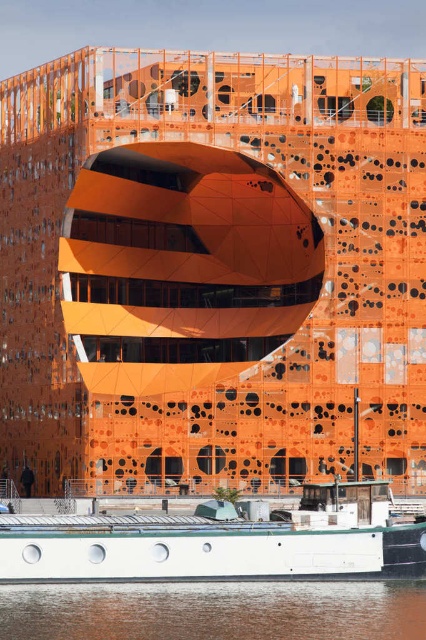
You are a tour guide explaining the scene to visitors. You mention the orange matte building at center and the white matte boat at lower center. How far apart are these two landmarks?

The orange matte building at center and the white matte boat at lower center are 85.88 feet apart.

You are standing on the deck of the white matte boat at lower center and want to take a photo of the orange matte building at center. Considering the height difference between the two, will the building appear mostly above or below the boat in the photo?

The orange matte building at center is much taller than the white matte boat at lower center, so in the photo taken from the boat, the building will appear mostly above the boat.

You are an architect evaluating the placement of a new sculpture. The sculpture requires a base that must be placed on the brown water at lower center. Can the sculpture be anchored to the orange matte building at center for stability?

The orange matte building at center is above brown water at lower center, so the sculpture cannot be anchored to the building since they are not at the same level.